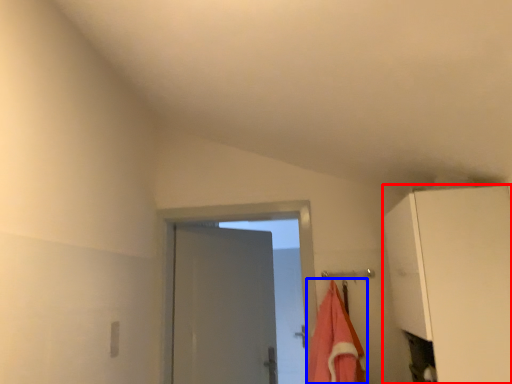
Question: Which object appears farthest to the camera in this image, cabinetry (highlighted by a red box) or beach towel (highlighted by a blue box)?

Choices:
 (A) cabinetry
 (B) beach towel

Answer: (B)